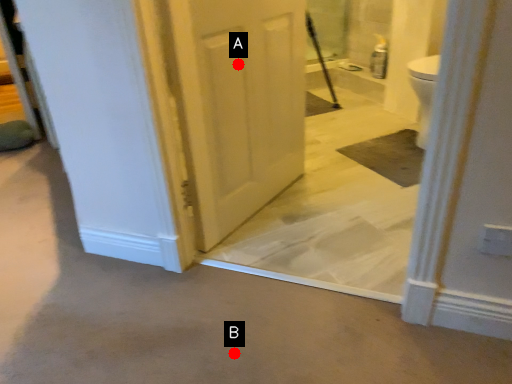
Question: Two points are circled on the image, labeled by A and B beside each circle. Among these points, which one is nearest to the camera?

Choices:
 (A) A is closer
 (B) B is closer

Answer: (B)